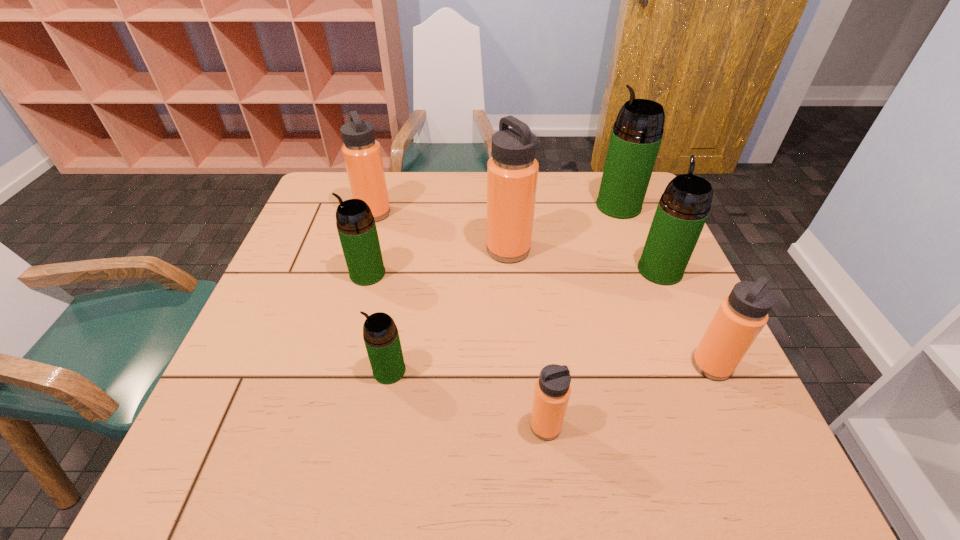
The height and width of the screenshot is (540, 960). I want to click on free space that satisfies the following two spatial constraints: 1. on the front side of the leftmost orange thermos bottle; 2. on the right side of the smallest orange thermos bottle, so click(312, 426).